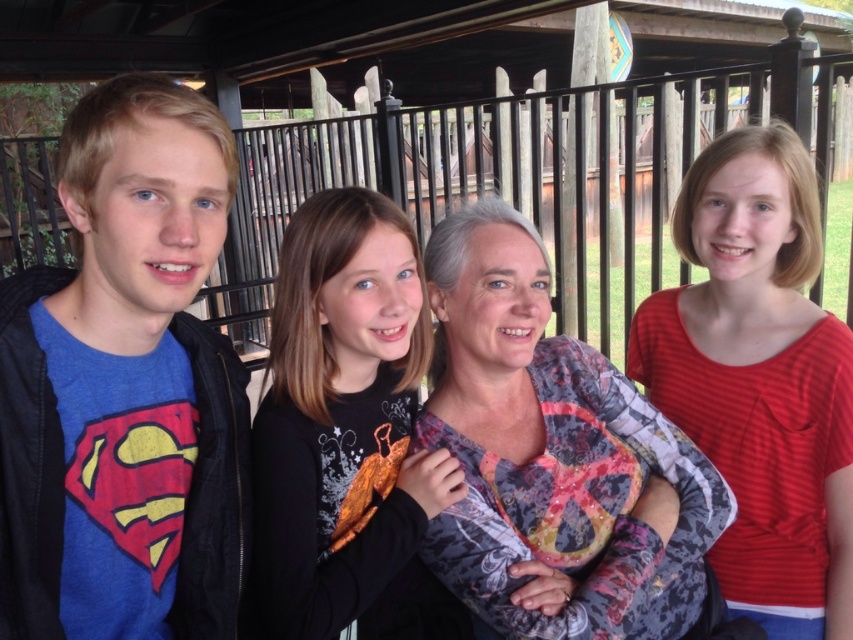
Question: Among these objects, which one is farthest from the camera?

Choices:
 (A) blue cotton t-shirt at left
 (B) red striped shirt at right
 (C) printed fabric blouse at center

Answer: (B)

Question: Is blue cotton t-shirt at left to the left of red striped shirt at right from the viewer's perspective?

Choices:
 (A) no
 (B) yes

Answer: (B)

Question: Considering the real-world distances, which object is closest to the black matte shirt at center?

Choices:
 (A) red striped shirt at right
 (B) blue cotton t-shirt at left
 (C) printed fabric blouse at center

Answer: (C)

Question: Which of the following is the farthest from the observer?

Choices:
 (A) (16, 291)
 (B) (625, 413)
 (C) (784, 456)
 (D) (305, 625)

Answer: (B)

Question: Is blue cotton t-shirt at left further to the viewer compared to red striped shirt at right?

Choices:
 (A) yes
 (B) no

Answer: (B)

Question: Can you confirm if blue cotton t-shirt at left is bigger than black matte shirt at center?

Choices:
 (A) yes
 (B) no

Answer: (B)